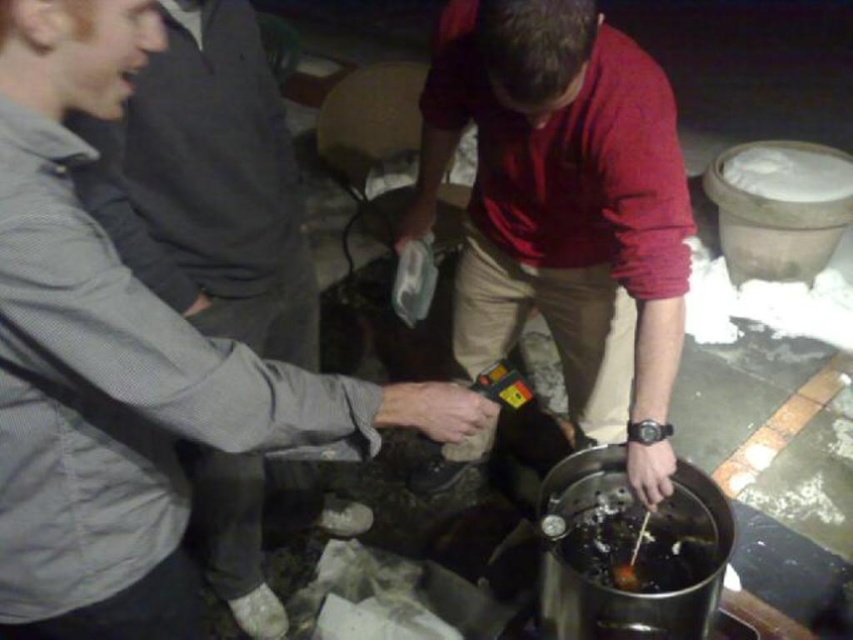
The width and height of the screenshot is (853, 640). Describe the element at coordinates (209, 184) in the screenshot. I see `gray fabric jacket at left` at that location.

Can you confirm if gray fabric jacket at left is positioned to the right of brown matte food at center?

No, gray fabric jacket at left is not to the right of brown matte food at center.

Describe the element at coordinates (209, 184) in the screenshot. I see `gray fabric jacket at left` at that location.

This screenshot has height=640, width=853. I want to click on gray fabric jacket at left, so click(x=209, y=184).

Does matte red shirt at center have a greater height compared to brown matte food at center?

Indeed, matte red shirt at center has a greater height compared to brown matte food at center.

Who is higher up, matte red shirt at center or brown matte food at center?

matte red shirt at center is higher up.

Does point (596, 428) come farther from viewer compared to point (598, 529)?

Yes, it is behind point (598, 529).

Locate an element on the screen. The image size is (853, 640). matte red shirt at center is located at coordinates (564, 209).

Does matte red shirt at center have a lesser width compared to gray fabric jacket at left?

No.

Looking at this image, who is more distant from viewer, [657,154] or [112,156]?

Positioned behind is point [112,156].

The width and height of the screenshot is (853, 640). In order to click on matte red shirt at center in this screenshot , I will do `click(564, 209)`.